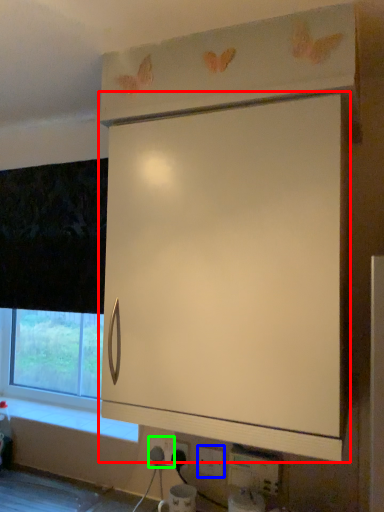
Question: Considering the real-world distances, which object is closest to cabinetry (highlighted by a red box)? electric outlet (highlighted by a blue box) or electric outlet (highlighted by a green box).

Choices:
 (A) electric outlet
 (B) electric outlet

Answer: (A)